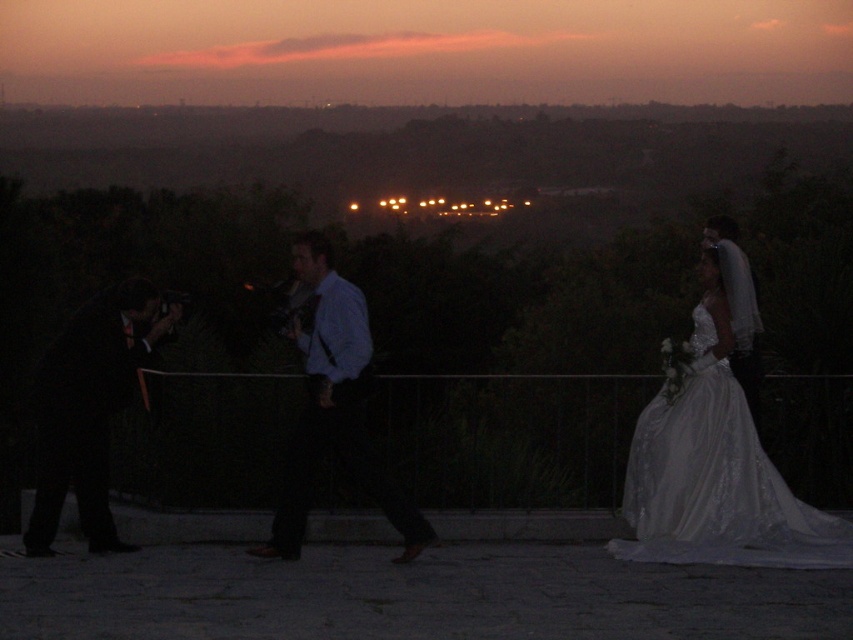
You are standing at the center of the scene and want to greet both the black suit at left and the white satin suit at right. Which one should you approach first to minimize the total distance walked?

You should approach the black suit at left first because it is closer to your starting position at the center than the white satin suit at right, which is farther away. The black suit at left is only 15.97 feet away from the white satin suit at right, but since you are at the center, the distance to each would be half of that, making the black suit closer.

You are a photographer positioned at the back of the scene. You want to take a photo that includes both the black suit at left and the blue shirt at center. Which subject should you adjust your focus to first to ensure both are in the frame?

You should focus on the black suit at left first because it is closer to you than the blue shirt at center, so adjusting focus starting from the closer subject ensures both are in the frame.

You are a photographer positioned at the back of the scene. You want to take a photo that includes both the white satin dress at right and the blue shirt at center. Which subject should you focus on first to ensure both are in clear focus?

The white satin dress at right is closer to the viewer than the blue shirt at center. To ensure both are in clear focus, you should focus on the white satin dress at right first, as it is closer, and the blue shirt at center will fall within the depth of field.